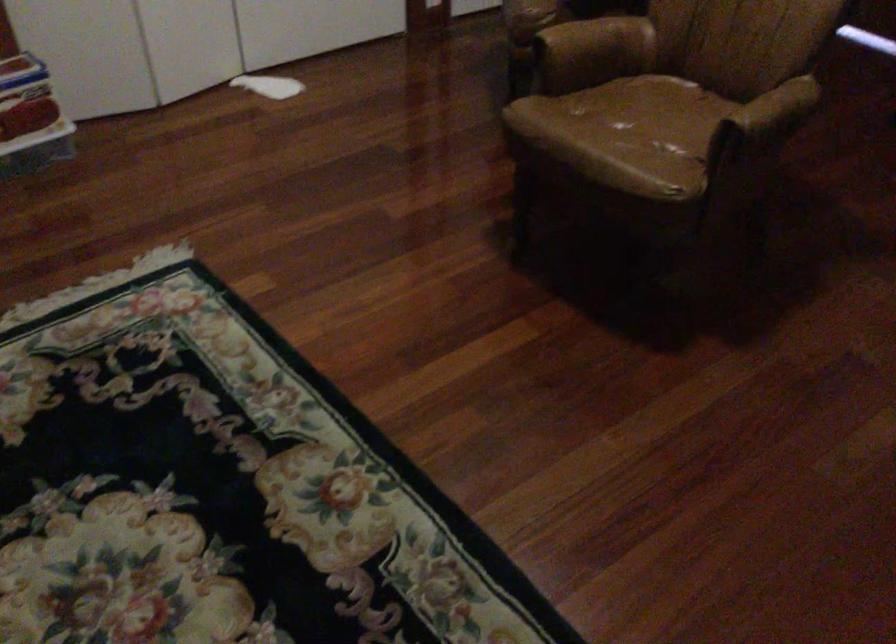
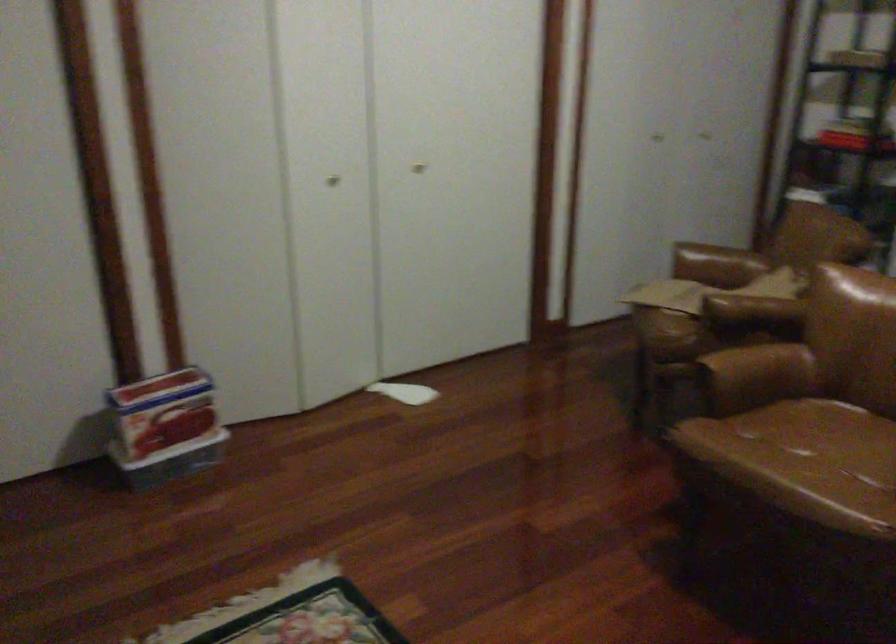
Question: Based on the continuous images, in which direction is the camera rotating? Reply with the corresponding letter.

Choices:
 (A) Left
 (B) Right
 (C) Up
 (D) Down

Answer: (C)